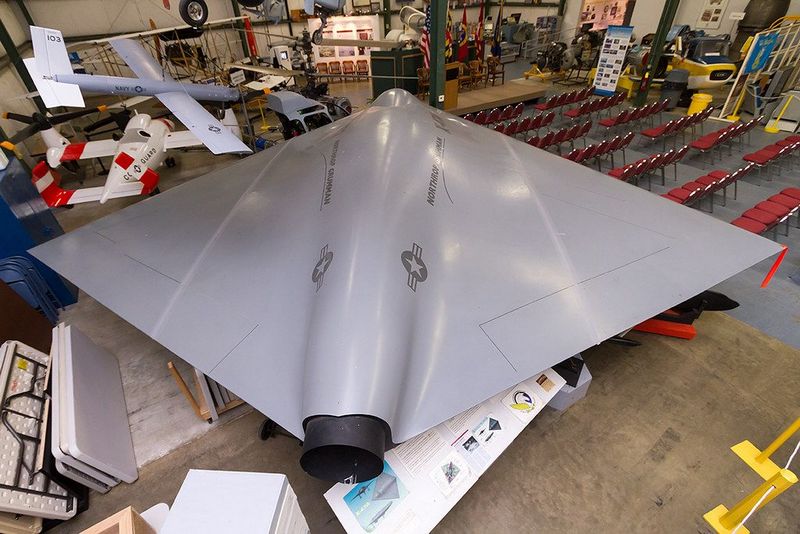
Locate an element on the screen. This screenshot has height=534, width=800. support beam is located at coordinates (436, 40), (664, 30).